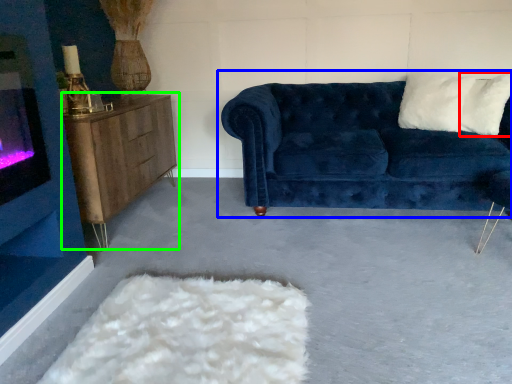
Question: Which is farther away from pillow (highlighted by a red box)? studio couch (highlighted by a blue box) or table (highlighted by a green box)?

Choices:
 (A) studio couch
 (B) table

Answer: (B)